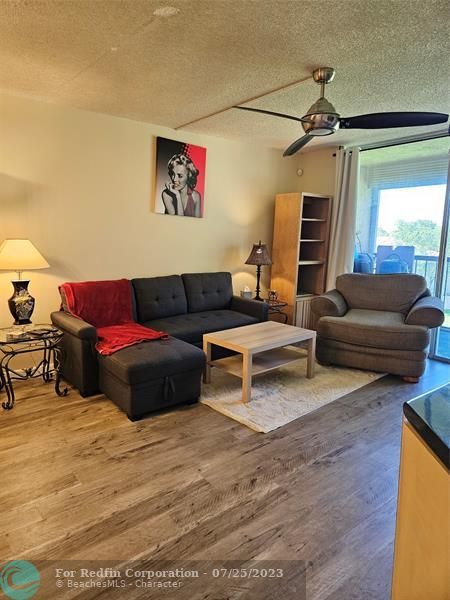
Where is `couch`? Image resolution: width=450 pixels, height=600 pixels. couch is located at coordinates (188, 311).